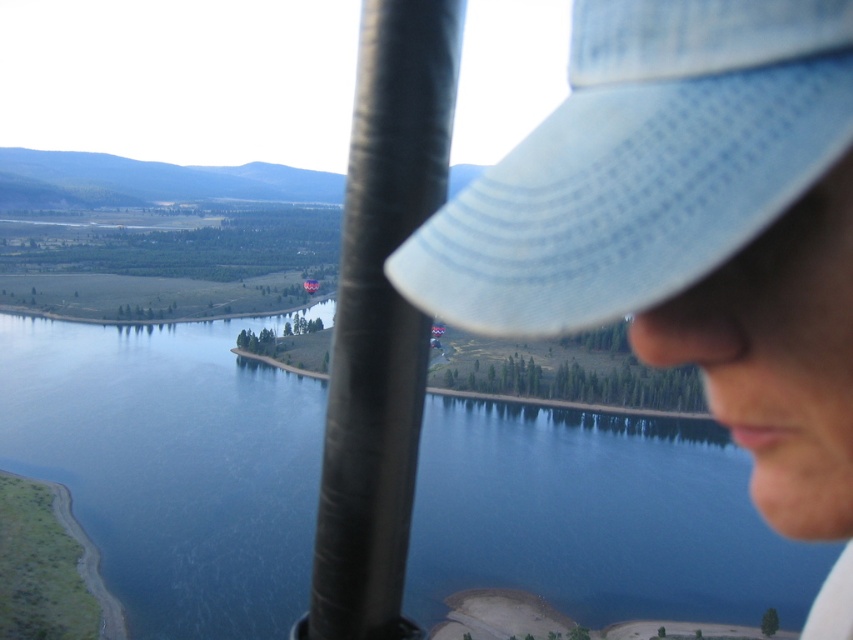
Question: Is blue water at center closer to camera compared to light blue woven baseball cap at upper right?

Choices:
 (A) no
 (B) yes

Answer: (A)

Question: Among these objects, which one is farthest from the camera?

Choices:
 (A) light blue woven baseball cap at upper right
 (B) blue water at center

Answer: (B)

Question: Is blue water at center smaller than light blue woven baseball cap at upper right?

Choices:
 (A) no
 (B) yes

Answer: (A)

Question: Which of the following is the closest to the observer?

Choices:
 (A) (782, 6)
 (B) (219, 346)

Answer: (A)

Question: Does blue water at center have a lesser width compared to light blue woven baseball cap at upper right?

Choices:
 (A) yes
 (B) no

Answer: (B)